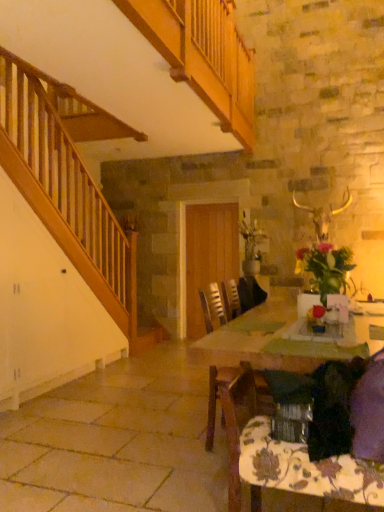
Image resolution: width=384 pixels, height=512 pixels. Find the location of `vacant space to the left of wooden chair at center`. vacant space to the left of wooden chair at center is located at coordinates (172, 444).